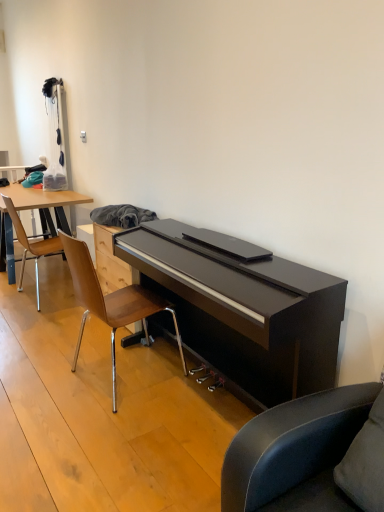
Question: In which direction should I rotate to look at wooden/metallic chair at center, the 2th chair positioned from the back?

Choices:
 (A) right
 (B) left

Answer: (B)

Question: Is wooden polished chair at left, which is the 2th chair in right-to-left order, behind wooden/metallic chair at center, which appears as the 1th chair when viewed from the front?

Choices:
 (A) yes
 (B) no

Answer: (A)

Question: Can you confirm if wooden polished chair at left, positioned as the 1th chair in back-to-front order, is positioned to the left of wooden/metallic chair at center, the 1th chair from the right?

Choices:
 (A) yes
 (B) no

Answer: (A)

Question: Is wooden/metallic chair at center, positioned as the second chair in left-to-right order, inside wooden polished chair at left, which is counted as the second chair, starting from the front?

Choices:
 (A) no
 (B) yes

Answer: (A)

Question: Can you see wooden polished chair at left, which is counted as the second chair, starting from the front, touching wooden/metallic chair at center, positioned as the second chair in left-to-right order?

Choices:
 (A) no
 (B) yes

Answer: (A)

Question: From a real-world perspective, is wooden polished chair at left, which is the 2th chair in right-to-left order, on wooden/metallic chair at center, the 2th chair positioned from the back?

Choices:
 (A) no
 (B) yes

Answer: (A)

Question: From a real-world perspective, is wooden polished chair at left, which is counted as the second chair, starting from the front, beneath wooden/metallic chair at center, the 1th chair from the right?

Choices:
 (A) no
 (B) yes

Answer: (B)

Question: Is wooden/metallic chair at center, the 1th chair from the right, facing away from wooden polished chair at left, positioned as the 1th chair in back-to-front order?

Choices:
 (A) yes
 (B) no

Answer: (B)

Question: From the image's perspective, is wooden/metallic chair at center, positioned as the second chair in left-to-right order, on top of wooden polished chair at left, which appears as the 1th chair when viewed from the left?

Choices:
 (A) no
 (B) yes

Answer: (A)

Question: From a real-world perspective, does wooden/metallic chair at center, which appears as the 1th chair when viewed from the front, sit lower than wooden polished chair at left, positioned as the 1th chair in back-to-front order?

Choices:
 (A) no
 (B) yes

Answer: (A)

Question: Does wooden/metallic chair at center, the 2th chair positioned from the back, have a lesser width compared to wooden polished chair at left, positioned as the 1th chair in back-to-front order?

Choices:
 (A) no
 (B) yes

Answer: (A)

Question: Is wooden/metallic chair at center, the 2th chair positioned from the back, positioned before wooden polished chair at left, positioned as the 1th chair in back-to-front order?

Choices:
 (A) no
 (B) yes

Answer: (B)

Question: Is wooden/metallic chair at center, the 1th chair from the right, at the right side of wooden polished chair at left, which is counted as the second chair, starting from the front?

Choices:
 (A) yes
 (B) no

Answer: (A)

Question: From a real-world perspective, is wooden polished chair at left, which is the 2th chair in right-to-left order, physically located above or below wooden/metallic chair at center, the 2th chair positioned from the back?

Choices:
 (A) below
 (B) above

Answer: (A)